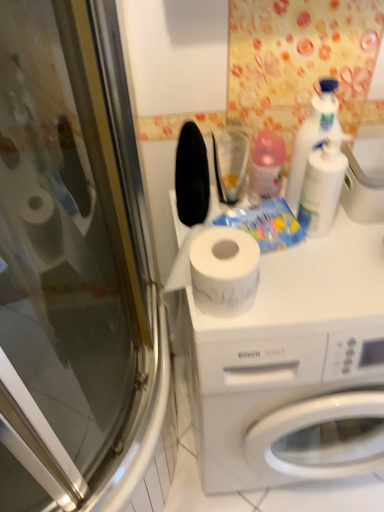
Question: Is white matte washing machine at center at the back of white plastic bottle at upper right, which is the 3th cleaning product in left-to-right order?

Choices:
 (A) no
 (B) yes

Answer: (A)

Question: Is white matte washing machine at center surrounded by white plastic bottle at upper right, marked as the first cleaning product in a right-to-left arrangement?

Choices:
 (A) yes
 (B) no

Answer: (B)

Question: From a real-world perspective, is white plastic bottle at upper right, which is the 3th cleaning product in left-to-right order, physically above white matte washing machine at center?

Choices:
 (A) yes
 (B) no

Answer: (A)

Question: Is white plastic bottle at upper right, which is the 3th cleaning product in left-to-right order, positioned far away from white matte washing machine at center?

Choices:
 (A) no
 (B) yes

Answer: (A)

Question: From a real-world perspective, does white plastic bottle at upper right, which is the 3th cleaning product in left-to-right order, sit lower than white matte washing machine at center?

Choices:
 (A) no
 (B) yes

Answer: (A)

Question: Visually, is white matte washing machine at center positioned to the left or to the right of white plastic bottle at upper right, the second cleaning product viewed from the left?

Choices:
 (A) left
 (B) right

Answer: (B)

Question: Do you think white matte washing machine at center is within white plastic bottle at upper right, which appears as the 2th cleaning product when viewed from the right, or outside of it?

Choices:
 (A) inside
 (B) outside

Answer: (B)

Question: In terms of size, does white matte washing machine at center appear bigger or smaller than white plastic bottle at upper right, the second cleaning product viewed from the left?

Choices:
 (A) small
 (B) big

Answer: (B)

Question: Does point (240, 304) appear closer or farther from the camera than point (311, 198)?

Choices:
 (A) closer
 (B) farther

Answer: (A)

Question: In terms of height, does transparent glass screen door at left look taller or shorter compared to white plastic bottle at upper right, the second cleaning product viewed from the left?

Choices:
 (A) tall
 (B) short

Answer: (A)

Question: Is transparent glass screen door at left bigger or smaller than white plastic bottle at upper right, which appears as the 2th cleaning product when viewed from the right?

Choices:
 (A) small
 (B) big

Answer: (B)

Question: In the image, is transparent glass screen door at left positioned in front of or behind white plastic bottle at upper right, the second cleaning product viewed from the left?

Choices:
 (A) front
 (B) behind

Answer: (A)

Question: Considering the positions of point (117, 480) and point (326, 187), is point (117, 480) closer or farther from the camera than point (326, 187)?

Choices:
 (A) closer
 (B) farther

Answer: (B)

Question: From a real-world perspective, is white plastic bottle at upper right, which is the 3th cleaning product in left-to-right order, physically located above or below transparent glass screen door at left?

Choices:
 (A) above
 (B) below

Answer: (A)

Question: Would you say white plastic bottle at upper right, which is the 3th cleaning product in left-to-right order, is inside or outside transparent glass screen door at left?

Choices:
 (A) inside
 (B) outside

Answer: (B)